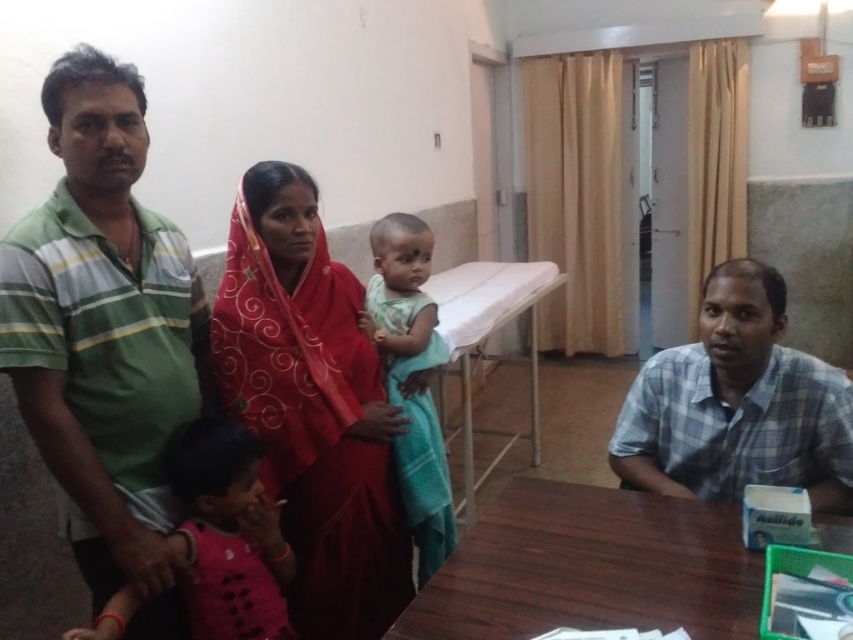
Question: Which of the following is the closest to the observer?

Choices:
 (A) blue plaid shirt at right
 (B) brown wooden table at lower right

Answer: (B)

Question: Observing the image, what is the correct spatial positioning of brown wooden table at lower right in reference to blue plaid shirt at right?

Choices:
 (A) below
 (B) above

Answer: (A)

Question: Based on their relative distances, which object is nearer to the brown wooden table at lower right?

Choices:
 (A) green striped shirt at left
 (B) red silk saree at center
 (C) pink fabric cloth at lower left

Answer: (B)

Question: Is the position of green striped shirt at left more distant than that of blue plaid shirt at right?

Choices:
 (A) no
 (B) yes

Answer: (A)

Question: Does red silk saree at center have a larger size compared to blue plaid shirt at right?

Choices:
 (A) no
 (B) yes

Answer: (B)

Question: Which point is farther to the camera?

Choices:
 (A) (113, 412)
 (B) (59, 109)
 (C) (225, 461)

Answer: (C)